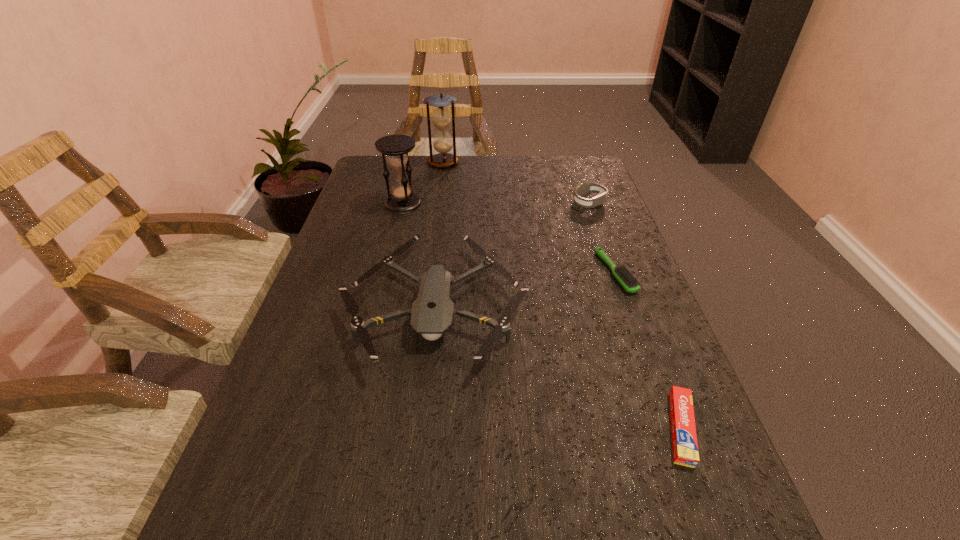
Identify the location of vacant area that lies between the shortest object and the watch. (635, 316).

Where is `empty space that is in between the watch and the fifth tallest object`? empty space that is in between the watch and the fifth tallest object is located at coordinates pyautogui.click(x=602, y=238).

This screenshot has width=960, height=540. Identify the location of free spot between the watch and the farther hourglass. (516, 183).

Locate an element on the screen. Image resolution: width=960 pixels, height=540 pixels. vacant point located between the shortest object and the watch is located at coordinates (635, 316).

The image size is (960, 540). In order to click on free spot between the drone and the shorter hourglass in this screenshot , I will do `click(420, 254)`.

Where is `free space between the hairbrush and the watch`? The height and width of the screenshot is (540, 960). free space between the hairbrush and the watch is located at coordinates (602, 238).

Identify which object is the fifth closest to the drone. Please provide its 2D coordinates. Your answer should be formatted as a tuple, i.e. [(x, y)], where the tuple contains the x and y coordinates of a point satisfying the conditions above.

[(441, 117)]

At what (x,y) coordinates should I click in order to perform the action: click on object that is the fifth closest to the farther hourglass. Please return your answer as a coordinate pair (x, y). The width and height of the screenshot is (960, 540). Looking at the image, I should click on (684, 439).

Locate an element on the screen. Image resolution: width=960 pixels, height=540 pixels. free location that satisfies the following two spatial constraints: 1. on the face of the nearest object; 2. on the right side of the watch is located at coordinates (668, 428).

Locate an element on the screen. vacant area in the image that satisfies the following two spatial constraints: 1. on the face of the toothpaste; 2. on the right side of the watch is located at coordinates (668, 428).